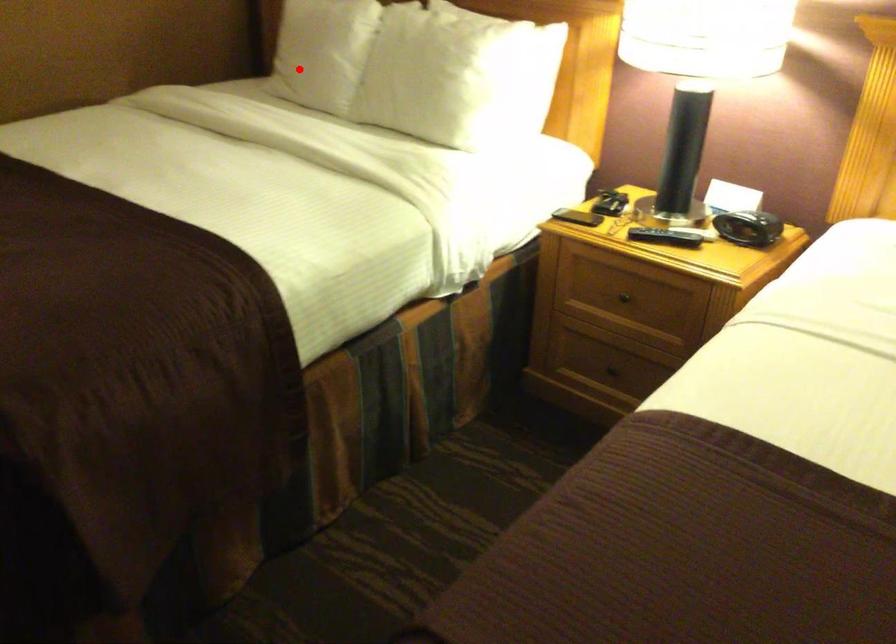
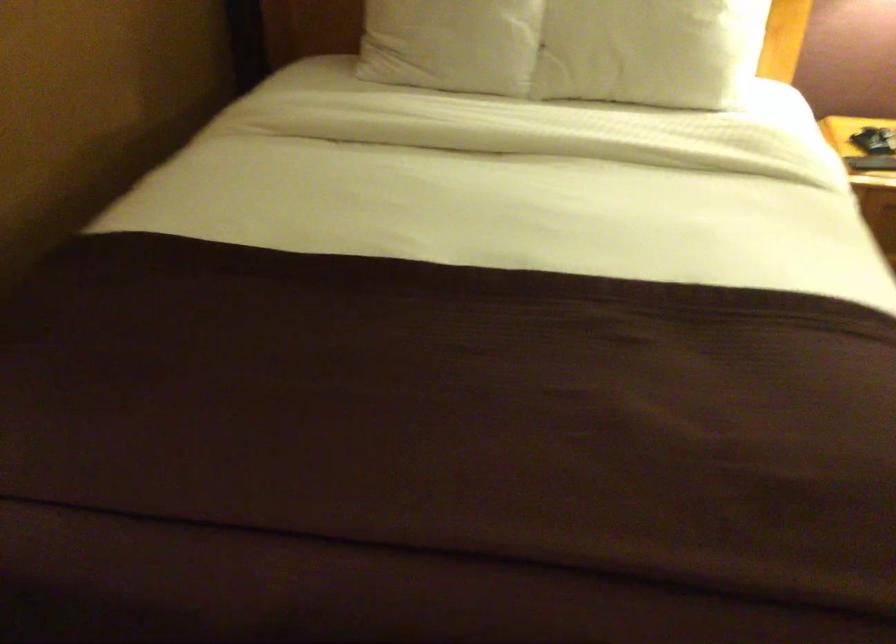
Find the pixel in the second image that matches the highlighted location in the first image.

(452, 44)